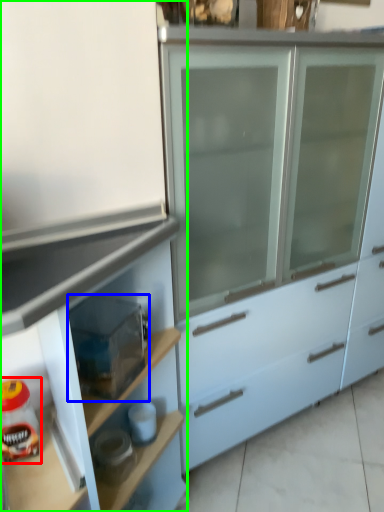
Question: Considering the real-world distances, which object is closest to food (highlighted by a red box)? appliance (highlighted by a blue box) or cabinetry (highlighted by a green box).

Choices:
 (A) appliance
 (B) cabinetry

Answer: (A)